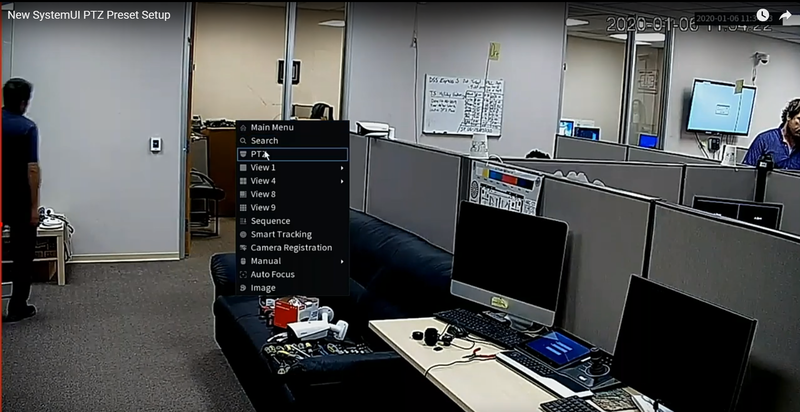
At what (x,y) coordinates should I click in order to perform the action: click on monitors. Please return your answer as a coordinate pair (x, y). This screenshot has width=800, height=412. Looking at the image, I should click on (474, 259), (650, 340).